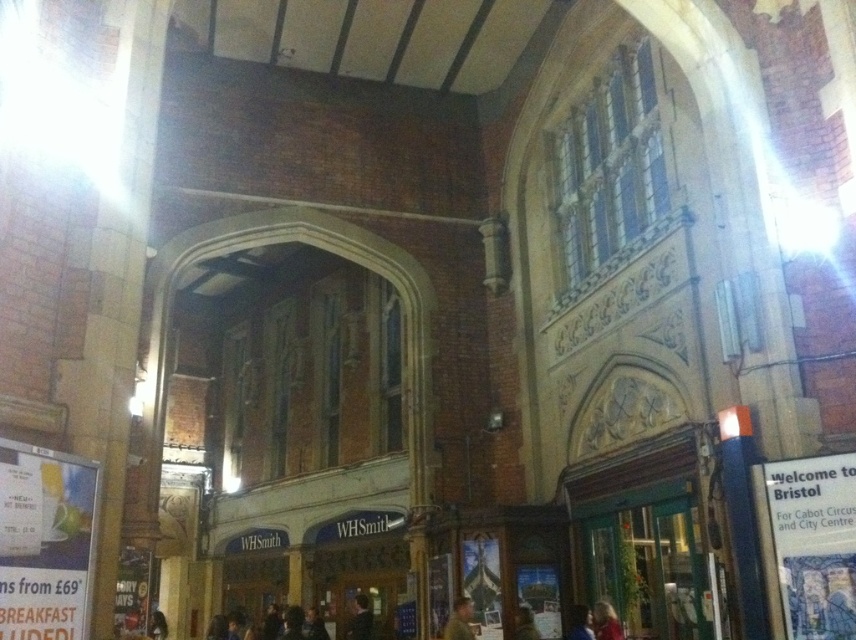
Question: Which point appears closest to the camera in this image?

Choices:
 (A) (575, 618)
 (B) (528, 609)

Answer: (A)

Question: Can you confirm if blonde hair at lower right is positioned to the left of brown leather jacket at lower center?

Choices:
 (A) yes
 (B) no

Answer: (B)

Question: Can you confirm if green fabric jacket at lower center is wider than blue fabric jacket at lower right?

Choices:
 (A) no
 (B) yes

Answer: (B)

Question: Is green fabric jacket at lower center closer to camera compared to dark brown leather jacket at center?

Choices:
 (A) no
 (B) yes

Answer: (B)

Question: Estimate the real-world distances between objects in this image. Which object is farther from the blonde hair at lower right?

Choices:
 (A) dark brown leather jacket at center
 (B) brown leather jacket at lower center
 (C) green fabric jacket at lower center

Answer: (A)

Question: Which point is farther from the camera taking this photo?

Choices:
 (A) (571, 620)
 (B) (599, 609)
 (C) (367, 637)
 (D) (468, 618)

Answer: (C)